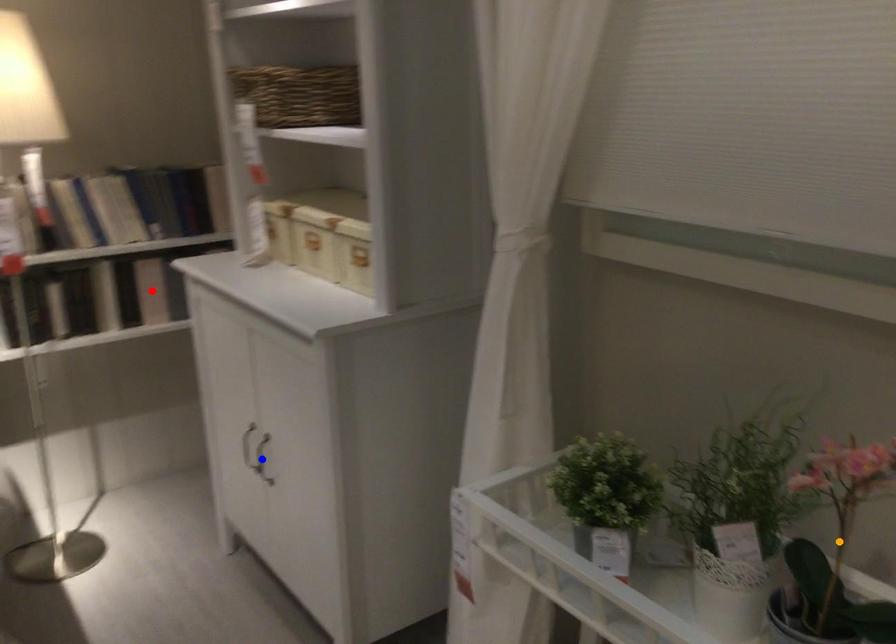
Order these from nearest to farthest:
1. red point
2. blue point
3. orange point

red point, blue point, orange point